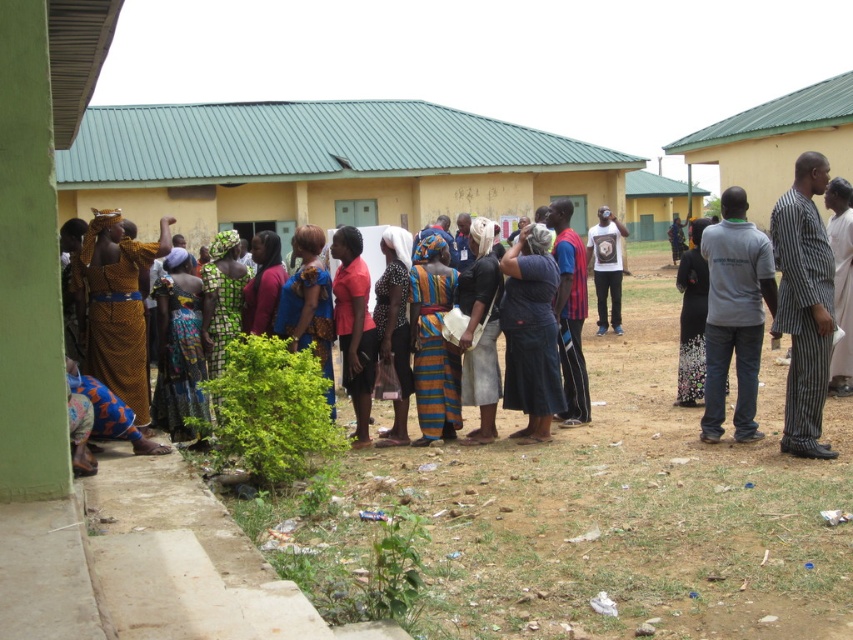
Does dark blue fabric at center have a smaller size compared to striped fabric dress at center?

No.

Does dark blue fabric at center have a larger size compared to striped fabric dress at center?

Yes, dark blue fabric at center is bigger than striped fabric dress at center.

Between point (540, 246) and point (456, 349), which one is positioned behind?

Point (456, 349)

The height and width of the screenshot is (640, 853). In order to click on dark blue fabric at center in this screenshot , I will do `click(531, 333)`.

Is point (482, 246) closer to camera compared to point (213, 264)?

That is True.

Is black woven cloth at center behind green printed dress at center?

That is False.

Is point (485, 227) closer to camera compared to point (228, 324)?

No, (485, 227) is further to viewer.

This screenshot has width=853, height=640. I want to click on black woven cloth at center, so click(482, 330).

What do you see at coordinates (433, 340) in the screenshot? This screenshot has width=853, height=640. I see `striped fabric dress at center` at bounding box center [433, 340].

Who is more distant from viewer, [413,282] or [187,365]?

The point [413,282] is behind.

Describe the element at coordinates (433, 340) in the screenshot. This screenshot has width=853, height=640. I see `striped fabric dress at center` at that location.

Where is `striped fabric dress at center`? The height and width of the screenshot is (640, 853). striped fabric dress at center is located at coordinates (433, 340).